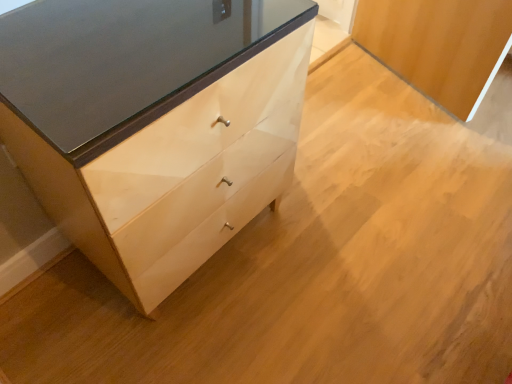
Question: Should I look upward or downward to see matte wood chest of drawers at lower left?

Choices:
 (A) up
 (B) down

Answer: (A)